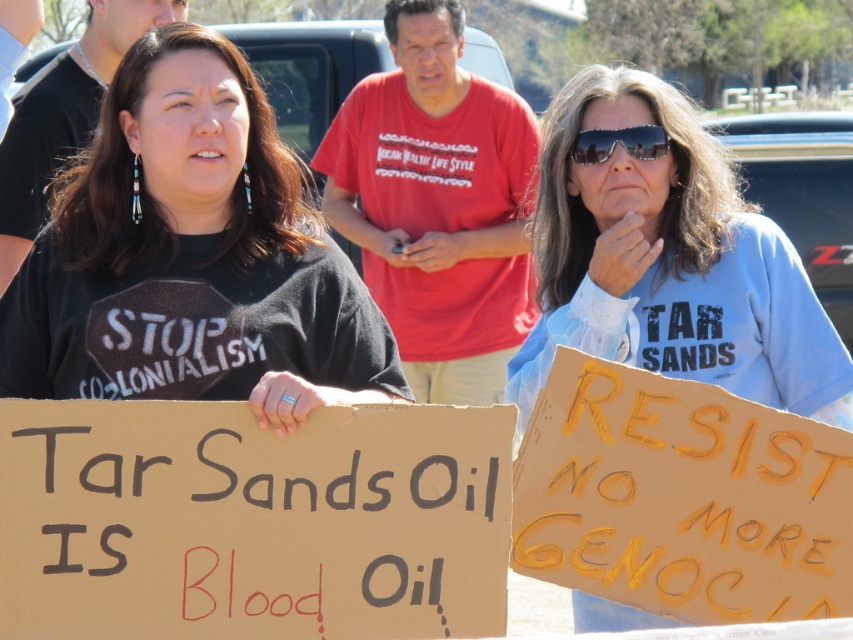
Question: Which object appears farthest from the camera in this image?

Choices:
 (A) black matte shirt at center
 (B) brown cardboard sign at center
 (C) yellow cardboard sign at center

Answer: (C)

Question: Considering the real-world distances, which object is closest to the brown cardboard sign at center?

Choices:
 (A) yellow cardboard sign at center
 (B) black matte shirt at center
 (C) sunglasses at center

Answer: (B)

Question: Does blue cotton shirt at center have a greater width compared to yellow cardboard sign at center?

Choices:
 (A) yes
 (B) no

Answer: (A)

Question: Estimate the real-world distances between objects in this image. Which object is farther from the black matte shirt at center?

Choices:
 (A) brown cardboard sign at center
 (B) sunglasses at center
 (C) blue cotton shirt at center

Answer: (B)

Question: Is brown cardboard sign at center to the right of sunglasses at center from the viewer's perspective?

Choices:
 (A) no
 (B) yes

Answer: (A)

Question: Can you confirm if brown cardboard sign at center is positioned to the right of black matte shirt at center?

Choices:
 (A) yes
 (B) no

Answer: (A)